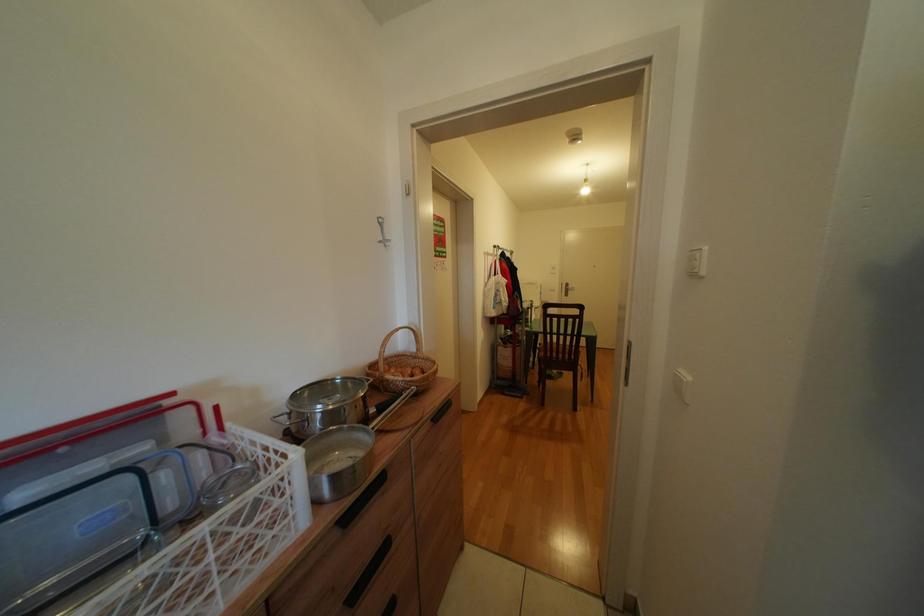
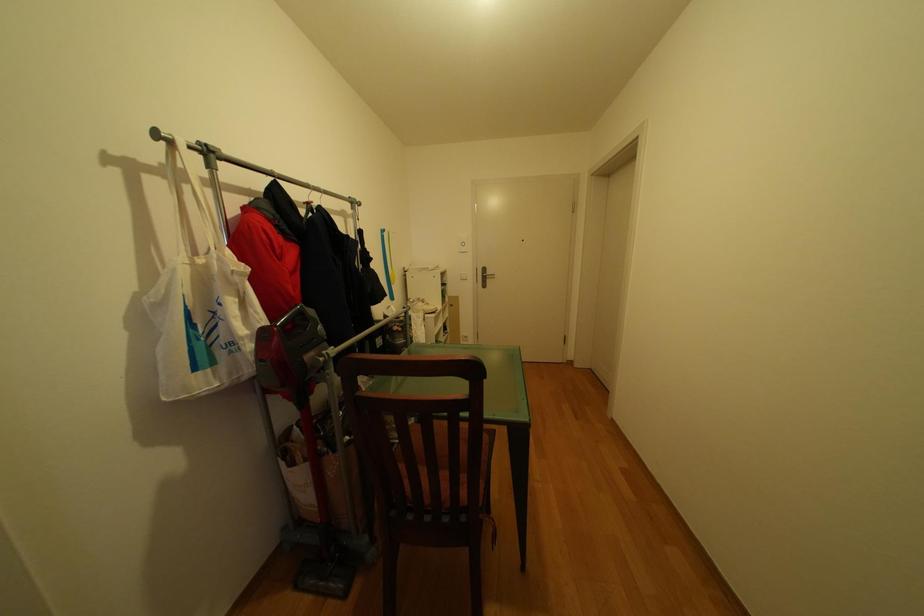
Based on the photo, what movement of the cameraman would produce the second image?

The cameraman walked toward right, forward.